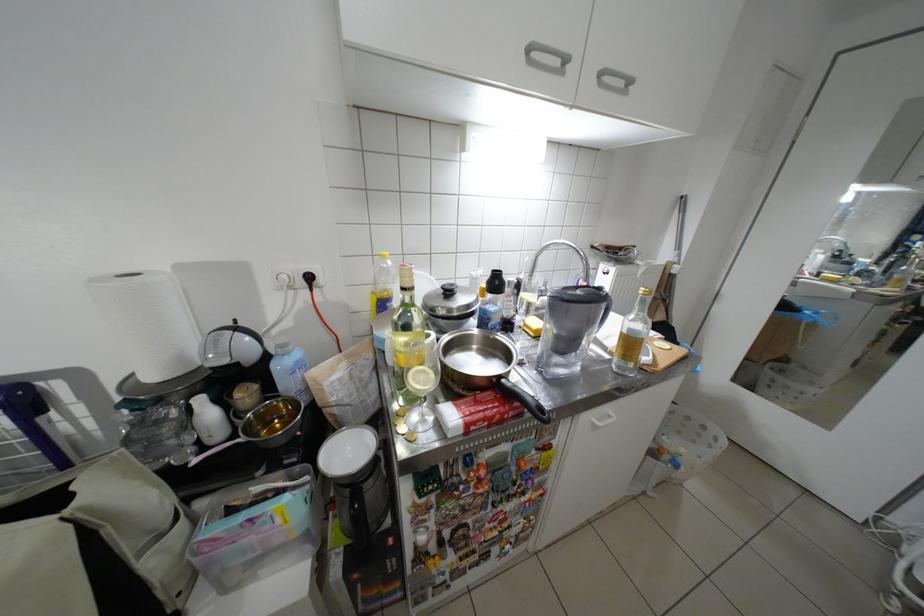
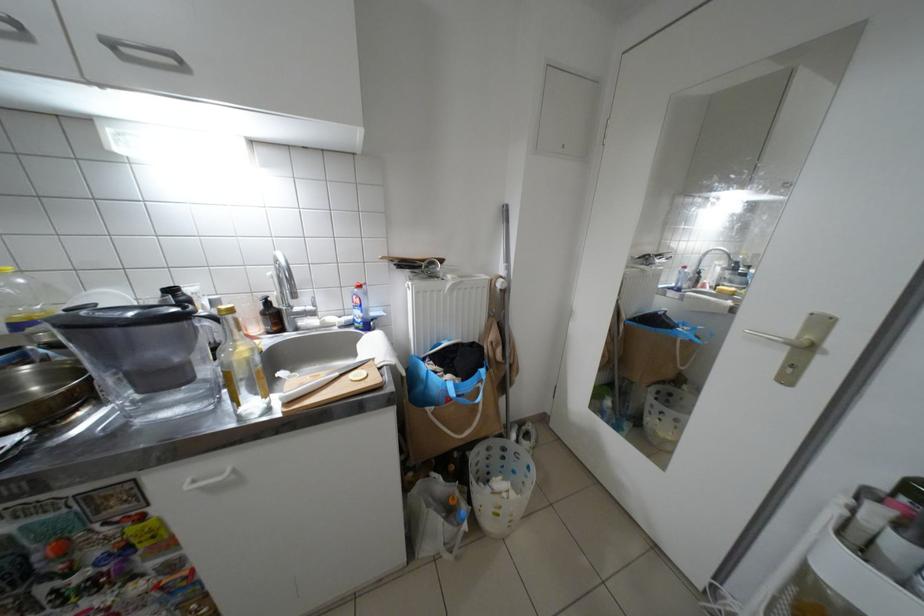
Where in the second image is the point corresponding to [613,75] from the first image?

(123, 46)